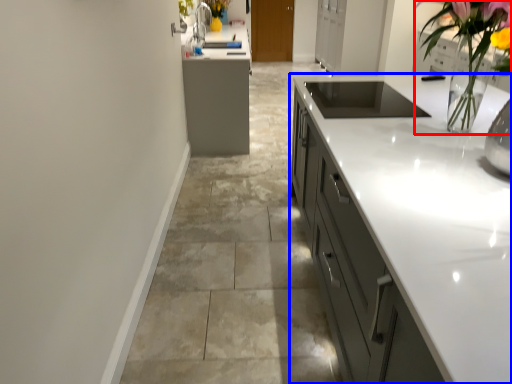
Question: Which point is further to the camera, floral arrangement (highlighted by a red box) or cabinetry (highlighted by a blue box)?

Choices:
 (A) floral arrangement
 (B) cabinetry

Answer: (B)